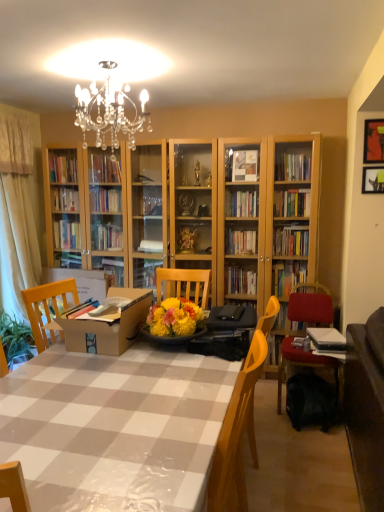
Question: Should I look upward or downward to see brown cardboard box at center?

Choices:
 (A) down
 (B) up

Answer: (A)

Question: Is white glossy table at center oriented towards brown cardboard box at center?

Choices:
 (A) no
 (B) yes

Answer: (A)

Question: Is white glossy table at center further to camera compared to brown cardboard box at center?

Choices:
 (A) no
 (B) yes

Answer: (A)

Question: Can you confirm if white glossy table at center is shorter than brown cardboard box at center?

Choices:
 (A) no
 (B) yes

Answer: (A)

Question: Does white glossy table at center have a smaller size compared to brown cardboard box at center?

Choices:
 (A) yes
 (B) no

Answer: (B)

Question: Is white glossy table at center bigger than brown cardboard box at center?

Choices:
 (A) no
 (B) yes

Answer: (B)

Question: Does white glossy table at center appear on the left side of brown cardboard box at center?

Choices:
 (A) yes
 (B) no

Answer: (B)

Question: From the image's perspective, is metallic gold picture frame at upper right, the 1th picture frame viewed from the top, located above brown cardboard box at center?

Choices:
 (A) yes
 (B) no

Answer: (A)

Question: Is metallic gold picture frame at upper right, which is counted as the second picture frame, starting from the bottom, smaller than brown cardboard box at center?

Choices:
 (A) no
 (B) yes

Answer: (B)

Question: Is metallic gold picture frame at upper right, which is counted as the second picture frame, starting from the bottom, surrounding brown cardboard box at center?

Choices:
 (A) no
 (B) yes

Answer: (A)

Question: Can you confirm if metallic gold picture frame at upper right, the 1th picture frame viewed from the top, is bigger than brown cardboard box at center?

Choices:
 (A) no
 (B) yes

Answer: (A)

Question: Is metallic gold picture frame at upper right, the 1th picture frame viewed from the top, at the right side of brown cardboard box at center?

Choices:
 (A) yes
 (B) no

Answer: (A)

Question: Would you say metallic gold picture frame at upper right, the 1th picture frame viewed from the top, is outside brown cardboard box at center?

Choices:
 (A) no
 (B) yes

Answer: (B)

Question: Is black fabric backpack at lower right placed right next to metallic silver picture frame at upper right, placed as the second picture frame when sorted from top to bottom?

Choices:
 (A) yes
 (B) no

Answer: (B)